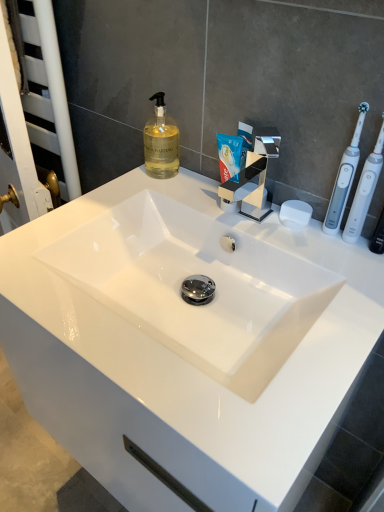
Where is `vacant space that's between translucent glass soap dispenser at upper center and white plastic toothbrush at right, positioned as the second toothbrush in left-to-right order`? vacant space that's between translucent glass soap dispenser at upper center and white plastic toothbrush at right, positioned as the second toothbrush in left-to-right order is located at coordinates (221, 195).